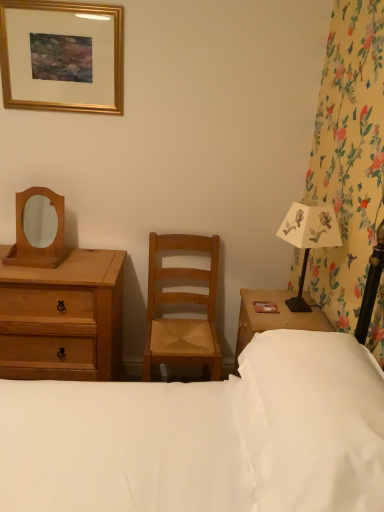
Identify the location of free space to the right of wooden mirror at left. (70, 266).